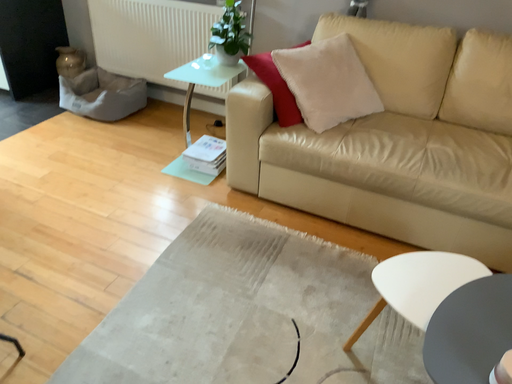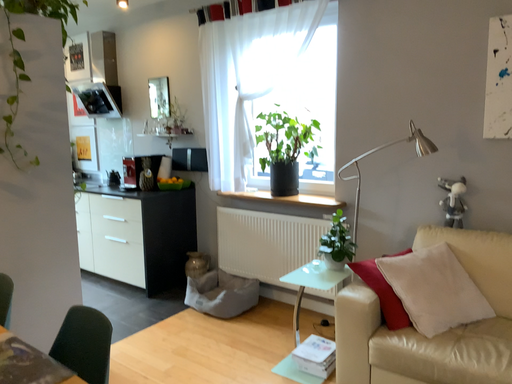
Question: How did the camera likely rotate when shooting the video?

Choices:
 (A) rotated upward
 (B) rotated downward

Answer: (A)